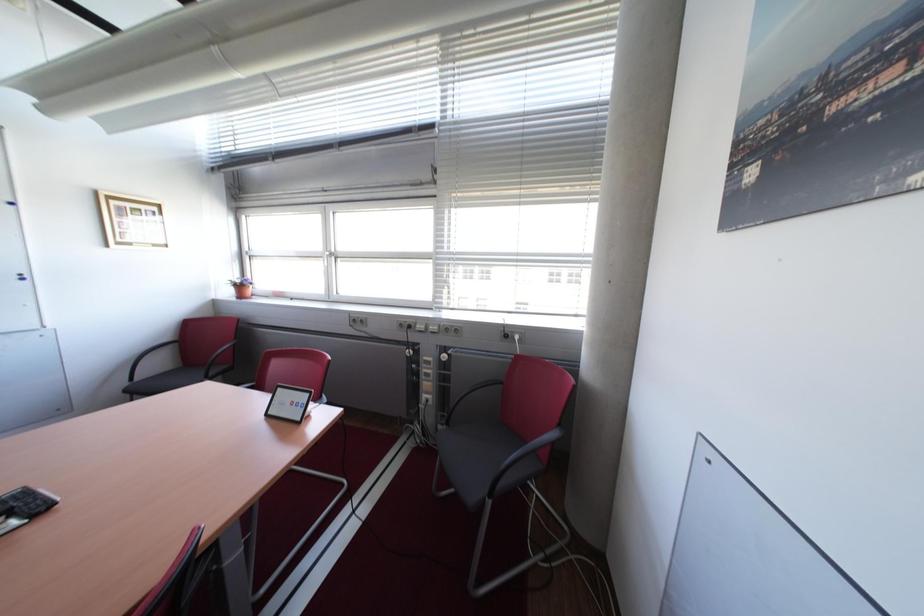
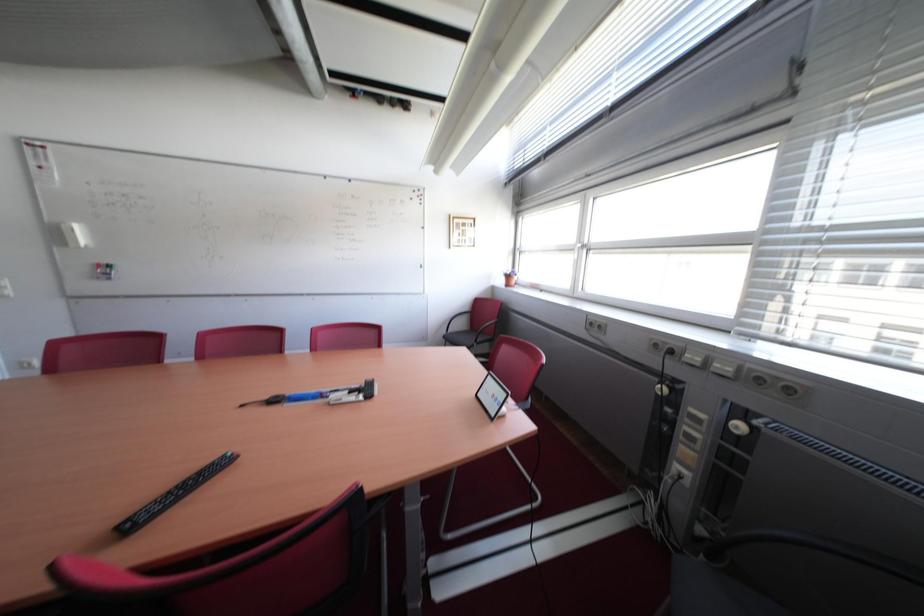
Question: The camera is either moving clockwise (left) or counter-clockwise (right) around the object. The first image is from the beginning of the video and the second image is from the end. Is the camera moving left or right when shooting the video?

Choices:
 (A) Left
 (B) Right

Answer: (B)